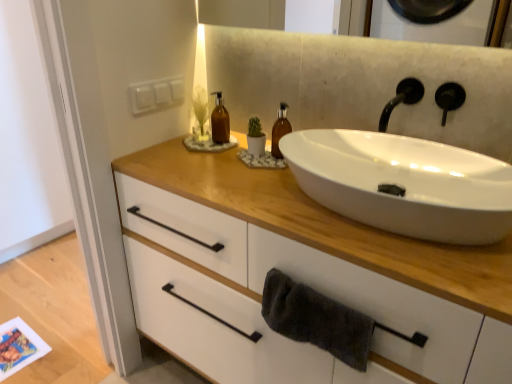
This screenshot has width=512, height=384. Find the location of `free point in front of brown glass bottle at center, the first bottle viewed from the left`. free point in front of brown glass bottle at center, the first bottle viewed from the left is located at coordinates (207, 164).